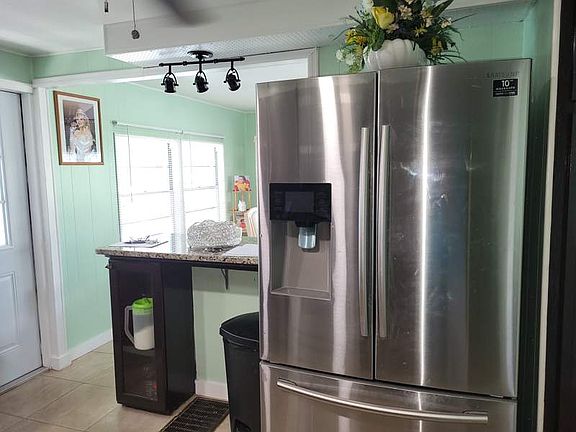
The height and width of the screenshot is (432, 576). Find the location of `painting`. painting is located at coordinates (77, 127).